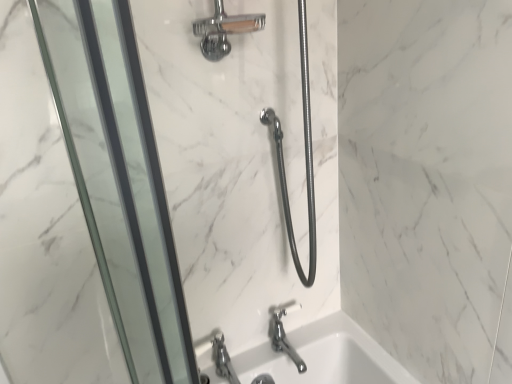
Describe the element at coordinates (119, 179) in the screenshot. I see `transparent glass shower door at left` at that location.

At what (x,y) coordinates should I click in order to perform the action: click on transparent glass shower door at left. Please return your answer as a coordinate pair (x, y). Looking at the image, I should click on (119, 179).

Locate an element on the screen. transparent glass shower door at left is located at coordinates (119, 179).